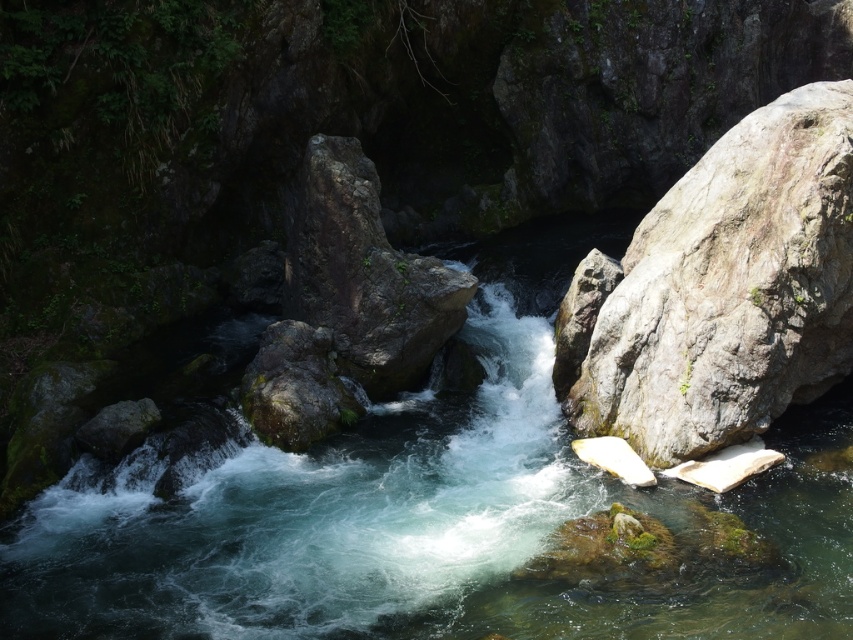
You are a kayaker planning to navigate through the river. You see the clear water at center and the gray rough rock at right. Which path should you choose to avoid getting stuck?

You should choose the clear water at center because it might be wider than the gray rough rock at right, providing a safer passage for your kayak.